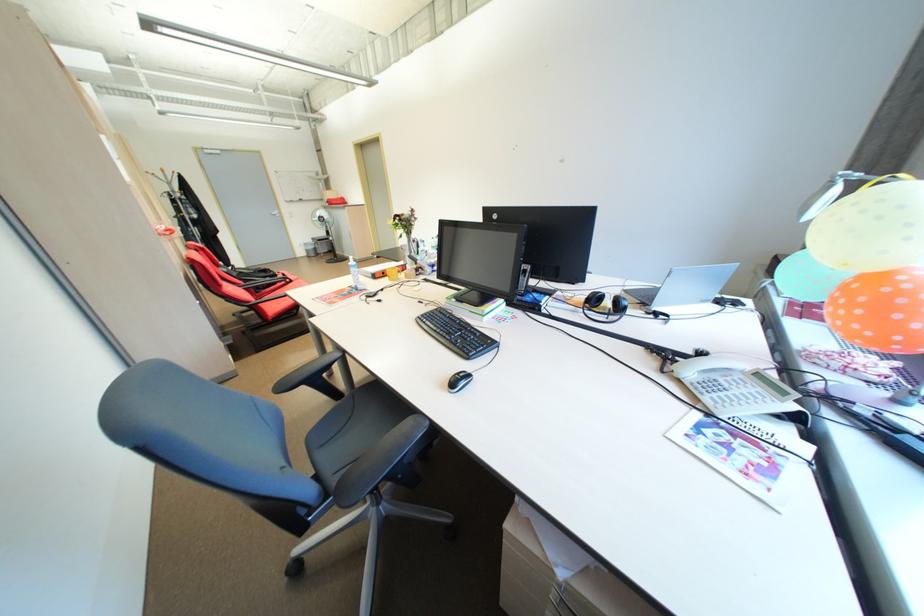
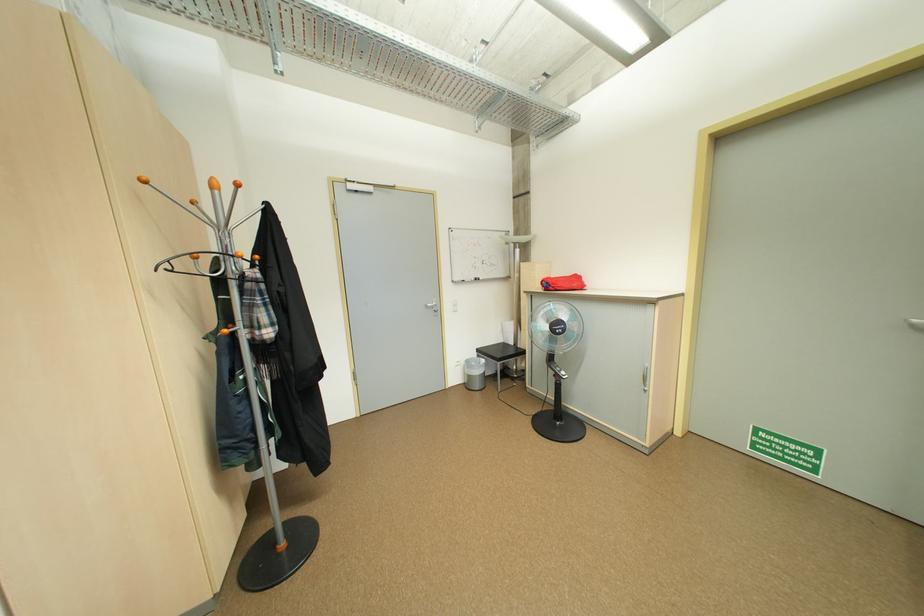
Question: I am providing you with two images of the same scene from different viewpoints. Which of the following objects are not visible in image2?

Choices:
 (A) orange coat rack hook
 (B) silver trash can
 (C) silver cabinet handle
 (D) none of these

Answer: (D)